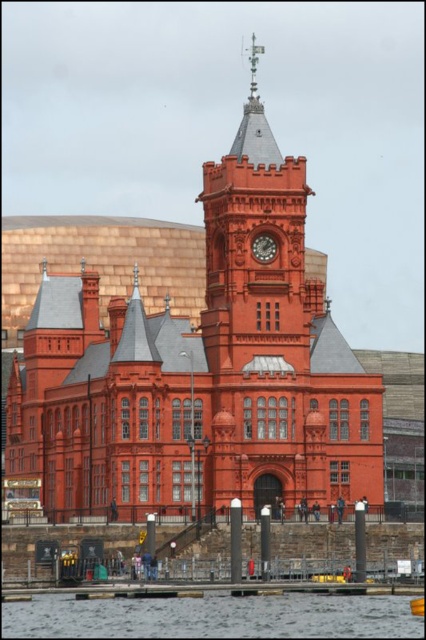
You are an architect analyzing the building and its surroundings. Based on the scene, which object, the transparent water at lower center or the matte red clock at center, occupies a larger horizontal space in the image?

The transparent water at lower center is wider than the matte red clock at center, so it occupies a larger horizontal space in the image.

You are standing on the dock and looking at the transparent water at lower center and the matte red clock at center. Which object is closer to you?

The transparent water at lower center is closer to you because it is in front of the matte red clock at center.

You are standing on the dock and looking at the transparent water at lower center and the matte red clock at center. Which object is positioned higher from your viewpoint?

The matte red clock at center is positioned higher than the transparent water at lower center because the water is located below the clock.